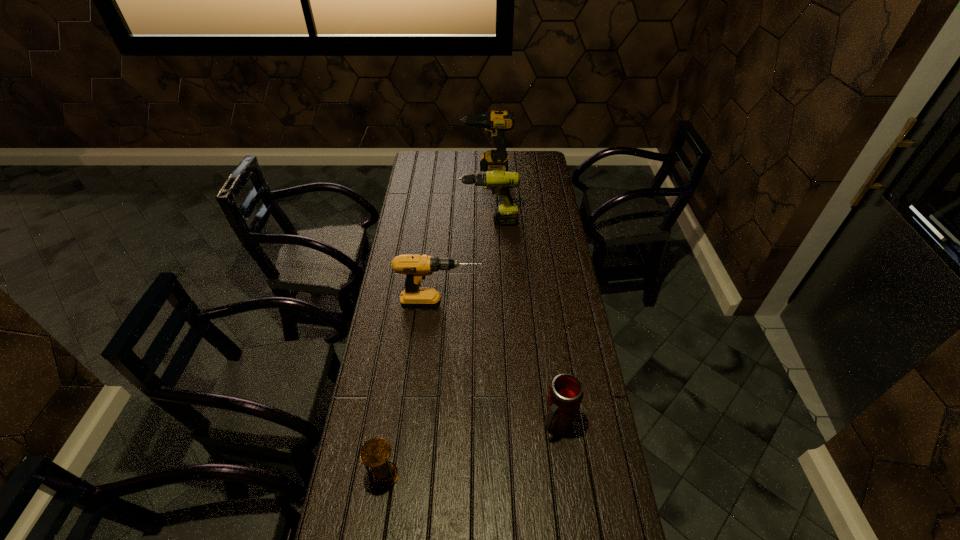
The height and width of the screenshot is (540, 960). Identify the location of object located at the right edge. (565, 395).

The height and width of the screenshot is (540, 960). Find the location of `blank space at the left edge`. blank space at the left edge is located at coordinates (383, 293).

You are a GUI agent. You are given a task and a screenshot of the screen. Output one action in this format:
    pyautogui.click(x=<x>, y=<y>)
    Task: Click on the vacant area at the right edge
    
    Given the screenshot: What is the action you would take?
    pyautogui.click(x=529, y=199)

This screenshot has height=540, width=960. In order to click on vacant area that lies between the nearest drill and the shortest object in this screenshot , I will do `click(413, 390)`.

Identify the location of free space between the third farthest object and the fourth farthest object. This screenshot has height=540, width=960. (499, 366).

Locate an element on the screen. The height and width of the screenshot is (540, 960). free space between the nearest object and the second shortest object is located at coordinates (470, 451).

The image size is (960, 540). In order to click on vacant area that lies between the second shortest object and the second farthest drill in this screenshot , I will do `click(523, 325)`.

Where is `free space that is in between the second nearest drill and the rightmost object`? The height and width of the screenshot is (540, 960). free space that is in between the second nearest drill and the rightmost object is located at coordinates (523, 325).

Find the location of a particular element. vacant region between the nearest drill and the thermos bottle is located at coordinates (499, 366).

The width and height of the screenshot is (960, 540). Identify the location of blank region between the fourth nearest object and the farthest object. (488, 195).